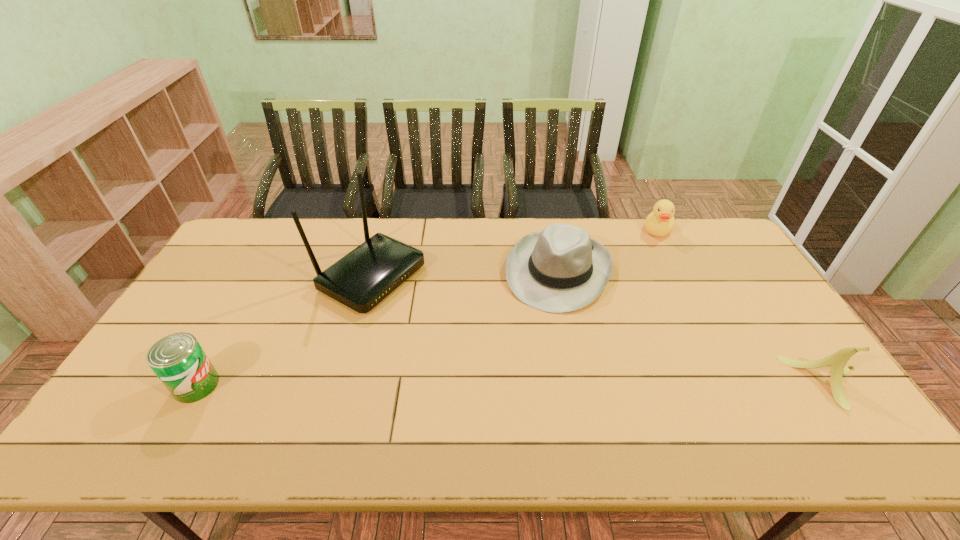
Choose which object is the nearest neighbor to the fourth object from right to left. Please provide its 2D coordinates. Your answer should be formatted as a tuple, i.e. [(x, y)], where the tuple contains the x and y coordinates of a point satisfying the conditions above.

[(178, 360)]

Locate an element on the screen. Image resolution: width=960 pixels, height=540 pixels. object identified as the second closest to the leftmost object is located at coordinates (560, 269).

The width and height of the screenshot is (960, 540). In order to click on free space that satisfies the following two spatial constraints: 1. on the front side of the router; 2. on the right side of the banana in this screenshot , I will do `click(343, 382)`.

The image size is (960, 540). What are the coordinates of `vacant area in the image that satisfies the following two spatial constraints: 1. on the back side of the fourth object from left to right; 2. on the right side of the third object from left to right` in the screenshot? It's located at (550, 230).

Locate an element on the screen. This screenshot has width=960, height=540. vacant space that satisfies the following two spatial constraints: 1. on the back side of the third object from left to right; 2. on the left side of the can is located at coordinates (260, 271).